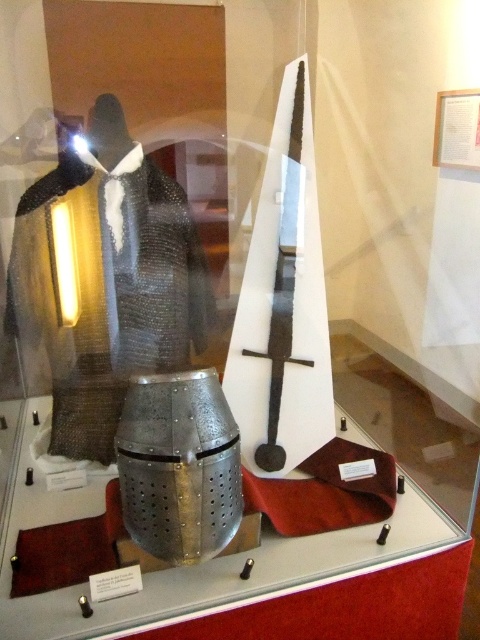
Between point (76, 417) and point (199, 400), which one is positioned behind?

The point (76, 417) is behind.

Does chainmail armor at left appear under polished silver helmet at center?

Actually, chainmail armor at left is above polished silver helmet at center.

Who is more forward, (121, 396) or (191, 493)?

Positioned in front is point (191, 493).

Where is `chainmail armor at left`? The image size is (480, 640). chainmail armor at left is located at coordinates (106, 280).

Is chainmail armor at left above polished steel sword at center?

No.

Is chainmail armor at left further to camera compared to polished steel sword at center?

No.

Between point (46, 342) and point (264, 465), which one is positioned in front?

Positioned in front is point (46, 342).

The image size is (480, 640). I want to click on chainmail armor at left, so click(106, 280).

Is polished silver helmet at center above polished steel sword at center?

Incorrect, polished silver helmet at center is not positioned above polished steel sword at center.

Who is shorter, polished silver helmet at center or polished steel sword at center?

With less height is polished silver helmet at center.

Describe the element at coordinates (179, 465) in the screenshot. I see `polished silver helmet at center` at that location.

The height and width of the screenshot is (640, 480). I want to click on polished silver helmet at center, so click(179, 465).